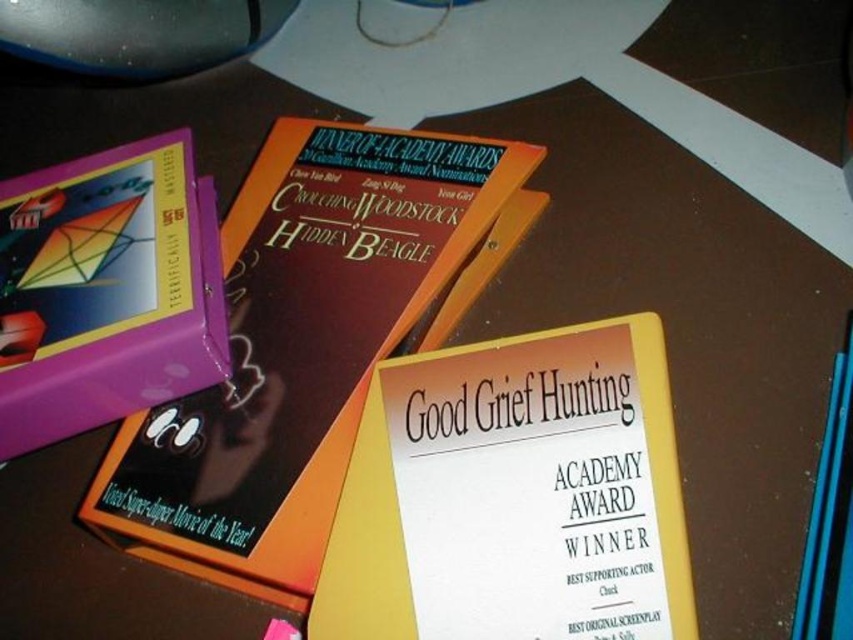
Question: Which is nearer to the purple matte book at left?

Choices:
 (A) matte orange book at center
 (B) black plastic mouse at upper left

Answer: (A)

Question: Which object appears closest to the camera in this image?

Choices:
 (A) black plastic mouse at upper left
 (B) matte orange book at center
 (C) yellow paper at center

Answer: (C)

Question: Is matte orange book at center positioned behind black plastic mouse at upper left?

Choices:
 (A) yes
 (B) no

Answer: (B)

Question: Based on their relative distances, which object is nearer to the matte orange book at center?

Choices:
 (A) purple matte book at left
 (B) black plastic mouse at upper left
 (C) yellow paper at center

Answer: (A)

Question: Observing the image, what is the correct spatial positioning of matte orange book at center in reference to purple matte book at left?

Choices:
 (A) right
 (B) left

Answer: (A)

Question: Can you confirm if purple matte book at left is positioned above black plastic mouse at upper left?

Choices:
 (A) no
 (B) yes

Answer: (A)